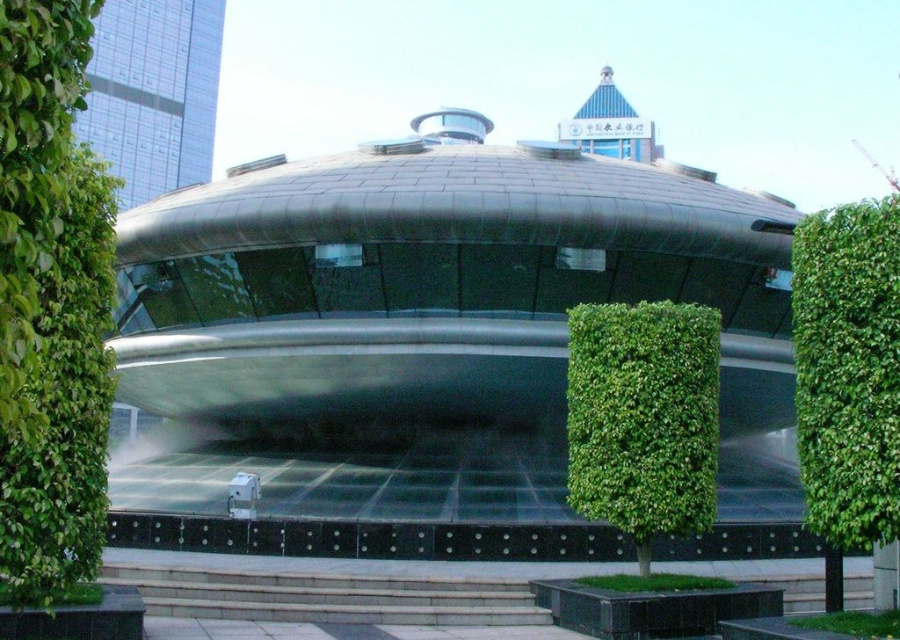
You are a landscape architect designing a pathway next to the green leafy tree at left and the green leafy bush at center. Which plant has a narrower width to allow more space for the pathway?

The green leafy tree at left is thinner than the green leafy bush at center, so it has a narrower width, allowing more space for the pathway.

You are a gardener planning to trim both the green leafy bush at center and the green leafy hedge at center. Which one do you think will require more time to trim due to its size?

The green leafy bush at center has a larger size compared to the green leafy hedge at center, so it will require more time to trim.